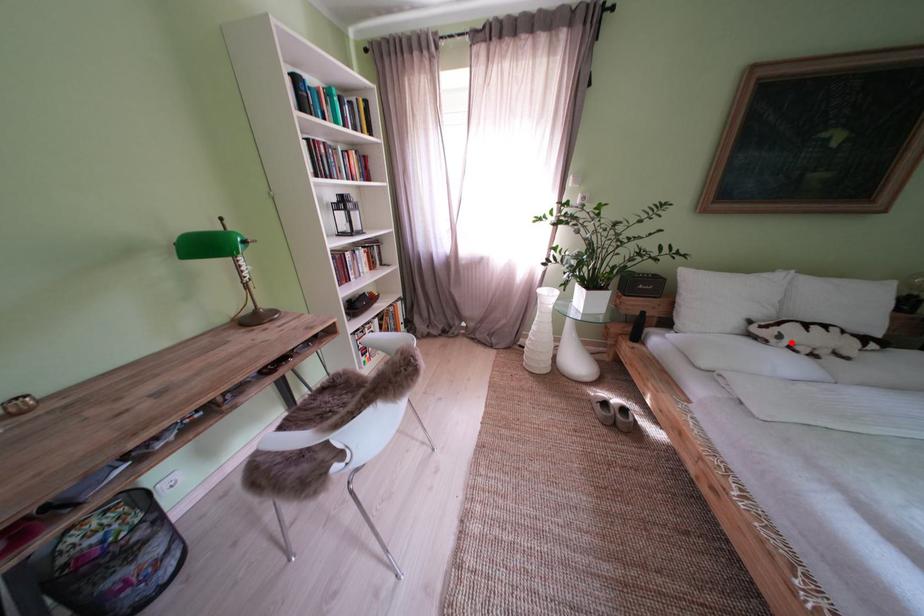
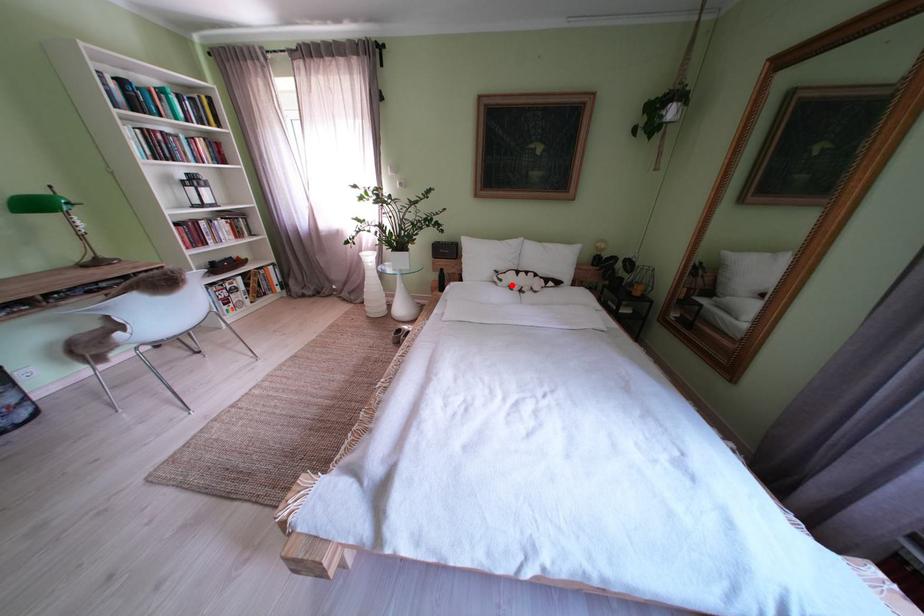
From the picture: I am providing you with two images of the same scene from different viewpoints. A red point is marked on the first image and another point is marked on the second image. Is the red point in image1 aligned with the point shown in image2?

Yes